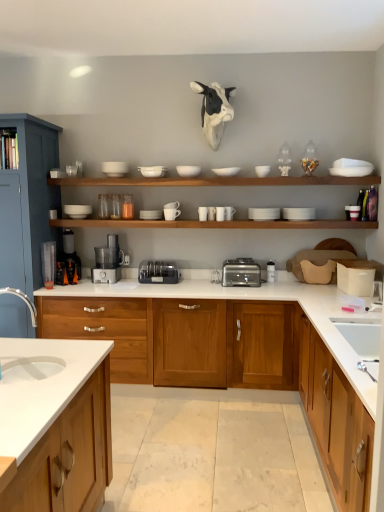
This screenshot has height=512, width=384. In order to click on free location to the right of white glossy sink at lower left, which appears as the second sink when viewed from the back in this screenshot , I will do `click(51, 367)`.